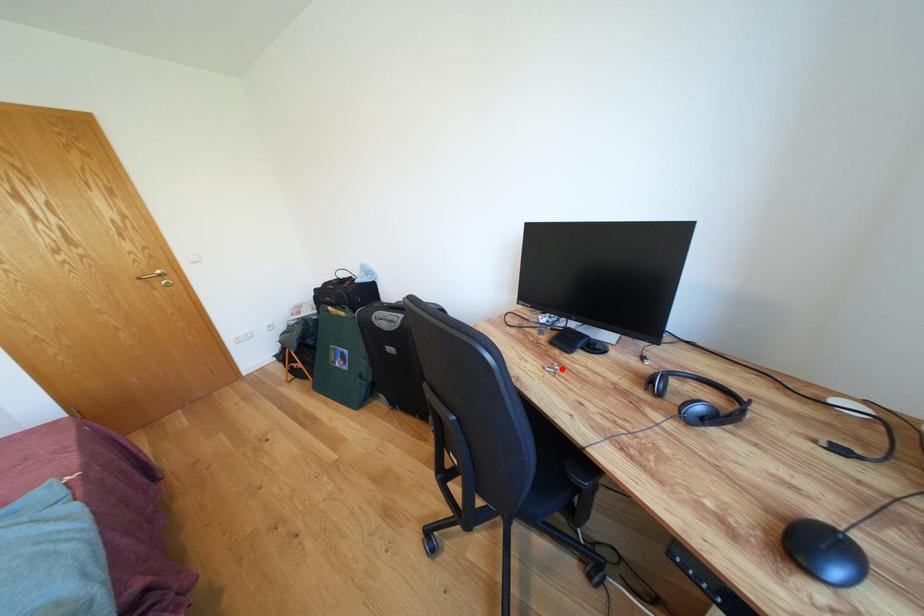
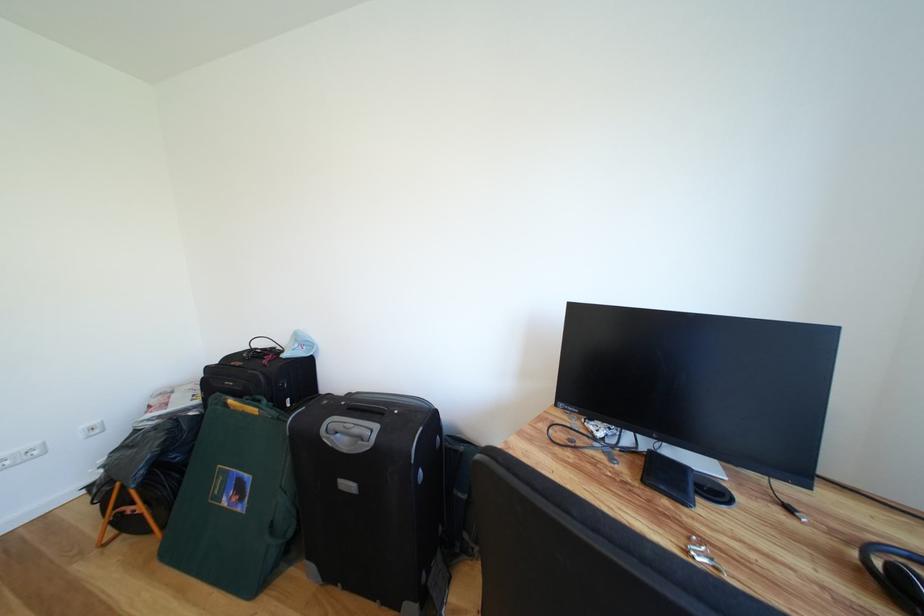
In the second image, find the point that corresponds to the highlighted location in the first image.

(698, 543)